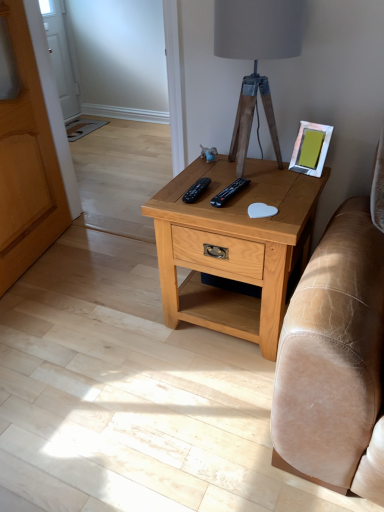
You are a GUI agent. You are given a task and a screenshot of the screen. Output one action in this format:
    pyautogui.click(x=<x>, y=<y>)
    Task: Click on the free space in front of light brown wood nightstand at center
    
    Given the screenshot: What is the action you would take?
    pyautogui.click(x=207, y=404)